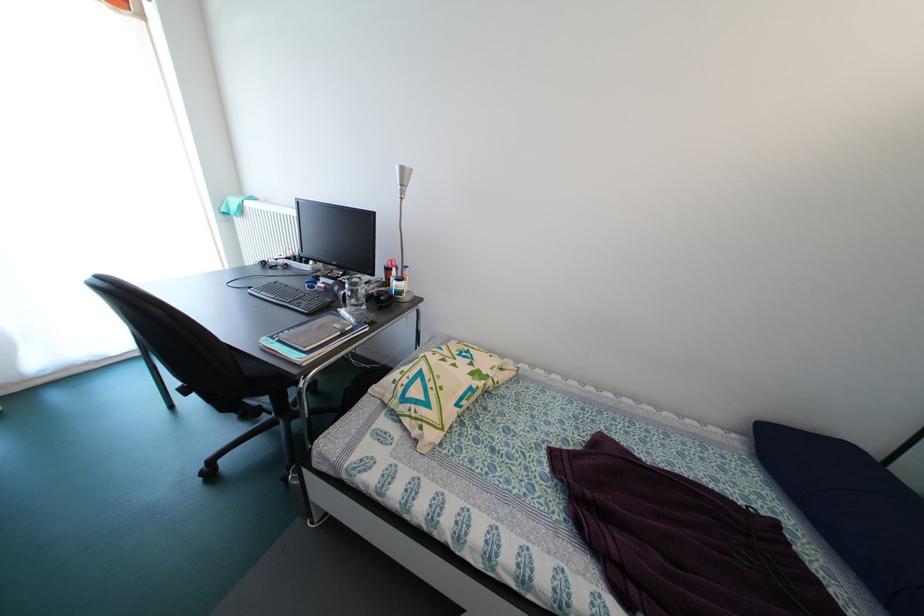
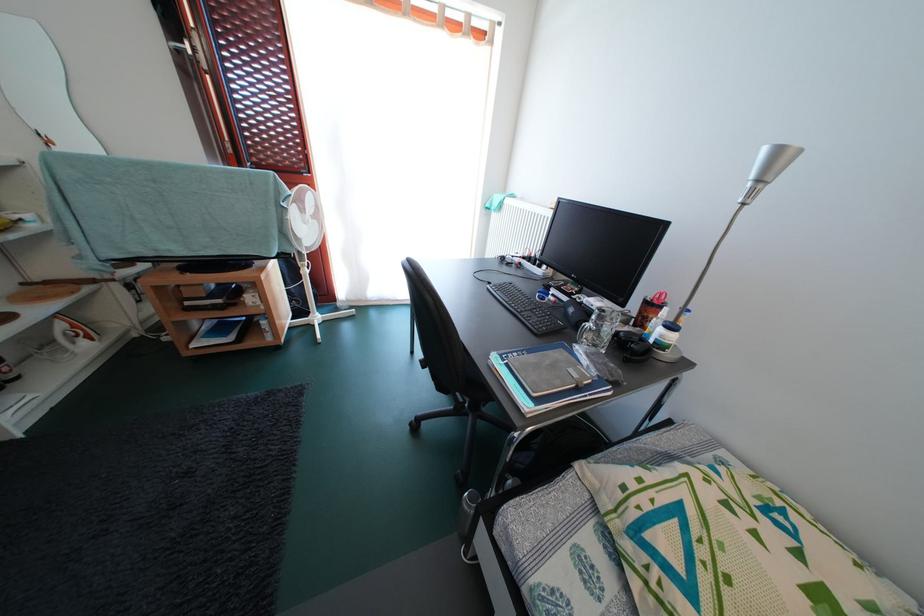
Question: The first image is from the beginning of the video and the second image is from the end. How did the camera likely rotate when shooting the video?

Choices:
 (A) Left
 (B) Right
 (C) Up
 (D) Down

Answer: (A)